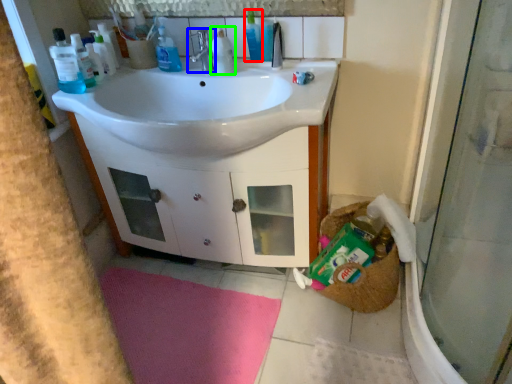
Question: Which object is the closest to the toiletry (highlighted by a red box)? Choose among these: tap (highlighted by a blue box) or cleaning product (highlighted by a green box).

Choices:
 (A) tap
 (B) cleaning product

Answer: (B)